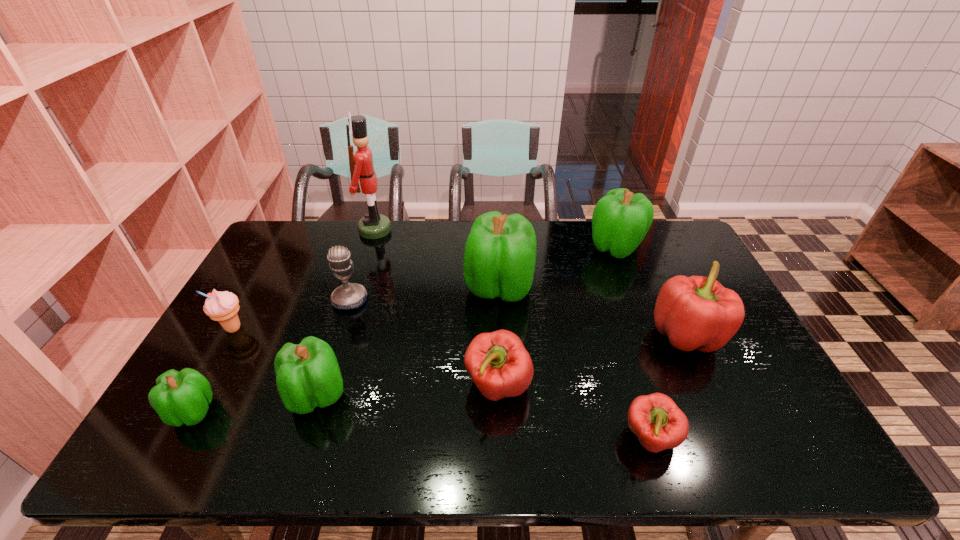
You are a GUI agent. You are given a task and a screenshot of the screen. Output one action in this format:
    pyautogui.click(x=<x>, y=<y>)
    Task: Click on the unoccupied position between the smallest green bell pepper and the ninth shortest object
    The height and width of the screenshot is (540, 960).
    Given the screenshot: What is the action you would take?
    pyautogui.click(x=347, y=349)

I want to click on free space between the nutcracker and the icecream, so click(x=304, y=279).

The height and width of the screenshot is (540, 960). What are the coordinates of `free area in between the second smallest green bell pepper and the second pink bell pepper from left to right` in the screenshot? It's located at point(484,416).

This screenshot has height=540, width=960. What are the coordinates of `blank region between the ninth shortest object and the smallest green bell pepper` in the screenshot? It's located at (347, 349).

Image resolution: width=960 pixels, height=540 pixels. In order to click on empty location between the biggest pink bell pepper and the icecream in this screenshot , I will do `click(460, 332)`.

The image size is (960, 540). I want to click on blank region between the microphone and the green nutcracker, so click(x=363, y=265).

The height and width of the screenshot is (540, 960). I want to click on blank region between the microphone and the rightmost pink bell pepper, so click(x=518, y=318).

The height and width of the screenshot is (540, 960). In order to click on free area in between the biggest green bell pepper and the rightmost green bell pepper in this screenshot , I will do `click(558, 267)`.

The height and width of the screenshot is (540, 960). Identify the location of object identified as the ninth closest to the rightmost pink bell pepper. (220, 306).

Locate an element on the screen. The height and width of the screenshot is (540, 960). object that stands as the third closest to the leftmost bell pepper is located at coordinates (349, 295).